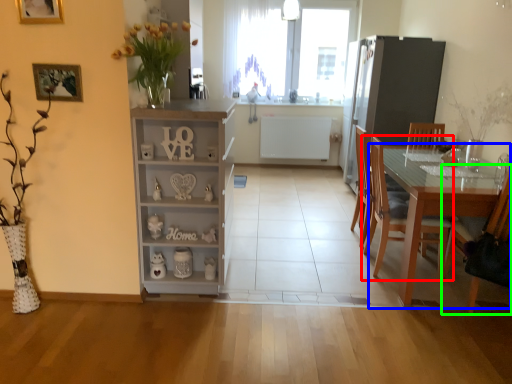
Question: Considering the real-world distances, which object is closest to chair (highlighted by a red box)? table (highlighted by a blue box) or chair (highlighted by a green box).

Choices:
 (A) table
 (B) chair

Answer: (A)